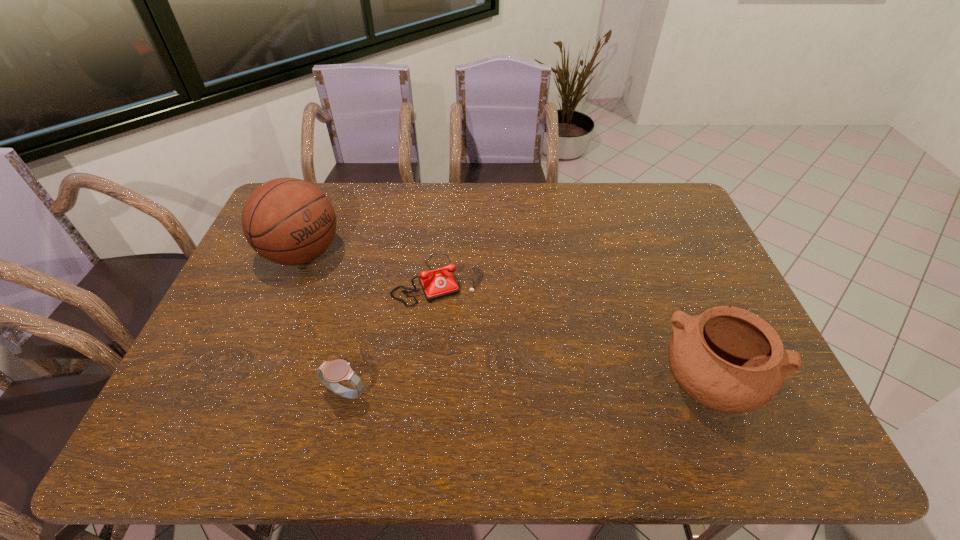
Find the location of a particular element. The height and width of the screenshot is (540, 960). vacant space on the desktop that is between the third tallest object and the rightmost object and is positioned on the dial of the shortest object is located at coordinates (486, 390).

At what (x,y) coordinates should I click in order to perform the action: click on vacant space on the desktop that is between the third tallest object and the second tallest object and is positioned on the side with brand label of the basketball. Please return your answer as a coordinate pair (x, y). The width and height of the screenshot is (960, 540). Looking at the image, I should click on (532, 389).